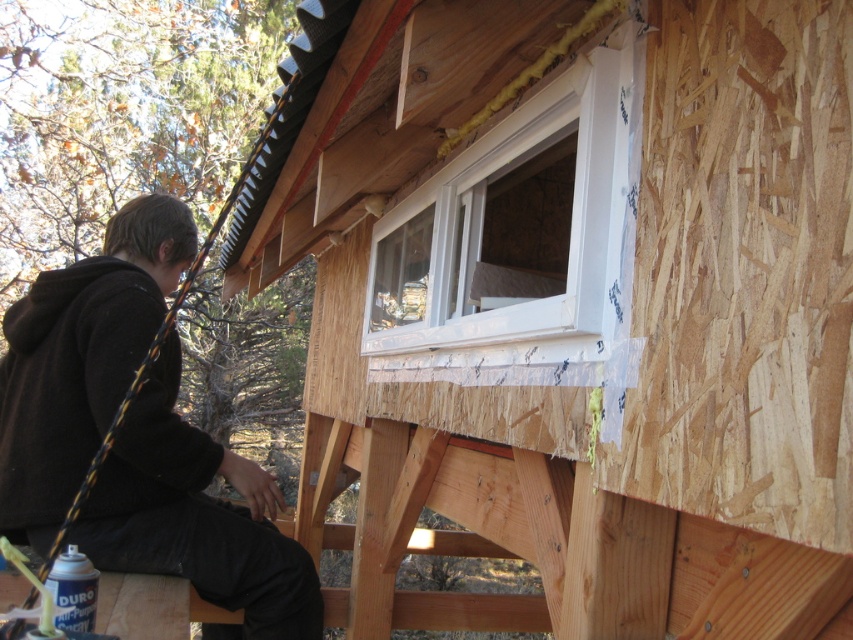
You are a contractor assessing the construction site. You notice the black hoodie at left and the white plastic window at upper center. Which object is located lower in the image?

The black hoodie at left is positioned under the white plastic window at upper center, so it is located lower in the image.